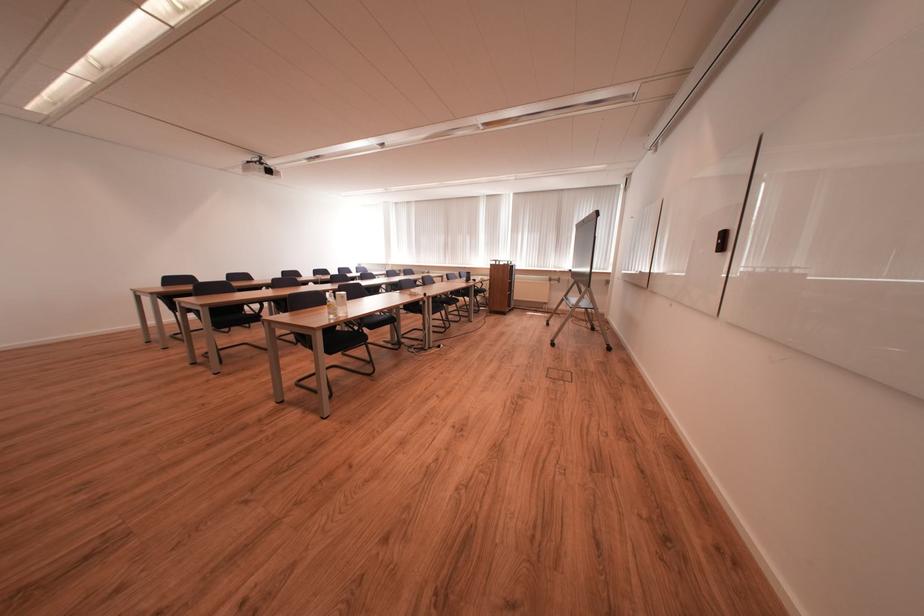
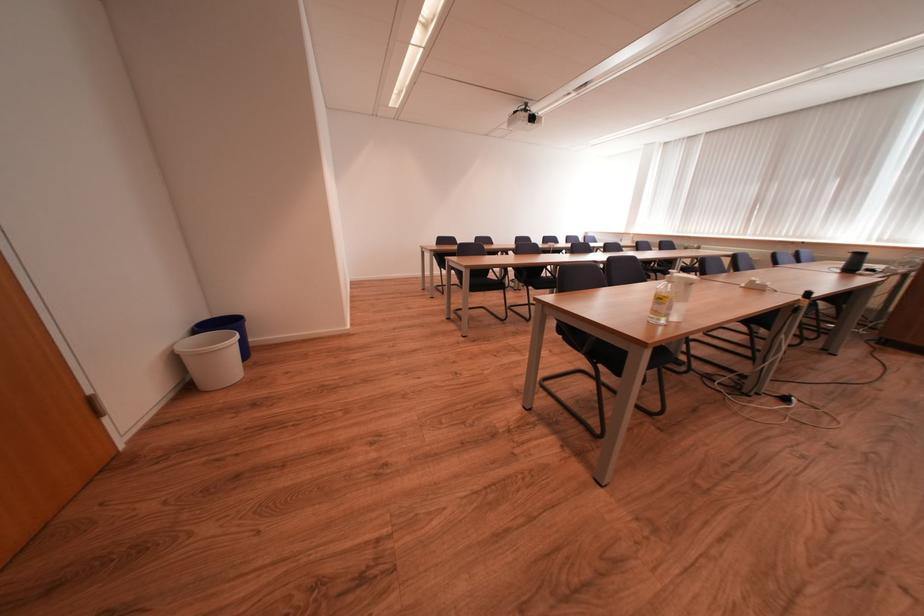
The point at (237, 318) is marked in the first image. Where is the corresponding point in the second image?

(489, 283)